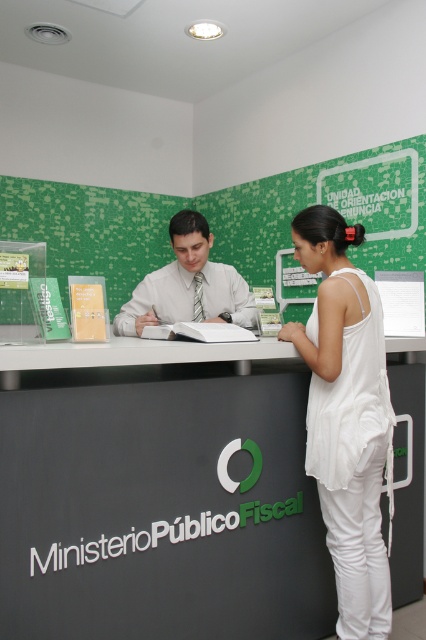
Question: From the image, what is the correct spatial relationship of matte black desk at center in relation to white cotton tank top at center?

Choices:
 (A) below
 (B) above

Answer: (A)

Question: Is white cotton tank top at center wider than white shirt at center?

Choices:
 (A) yes
 (B) no

Answer: (B)

Question: Is matte black desk at center to the right of white shirt at center from the viewer's perspective?

Choices:
 (A) no
 (B) yes

Answer: (B)

Question: Which of these objects is positioned farthest from the white cotton tank top at center?

Choices:
 (A) white shirt at center
 (B) matte black desk at center

Answer: (A)

Question: Estimate the real-world distances between objects in this image. Which object is closer to the white shirt at center?

Choices:
 (A) matte black desk at center
 (B) white cotton tank top at center

Answer: (A)

Question: Which object is closer to the camera taking this photo?

Choices:
 (A) white cotton tank top at center
 (B) matte black desk at center
 (C) white shirt at center

Answer: (B)